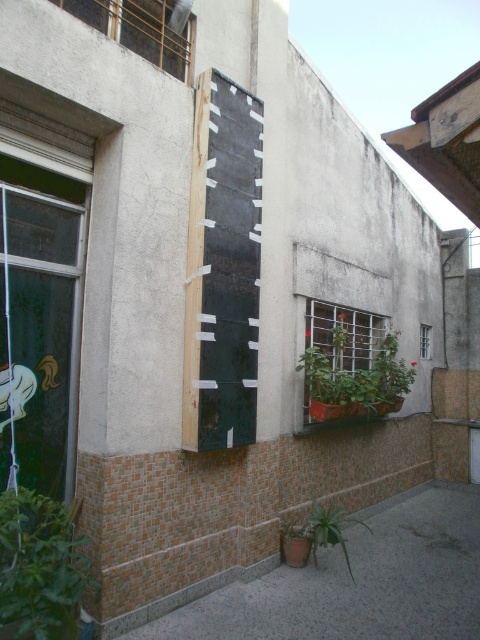
Is brown textured wall at lower right positioned behind dark green wood at center?

No.

Which is more to the left, brown textured wall at lower right or dark green wood at center?

dark green wood at center is more to the left.

I want to click on brown textured wall at lower right, so click(359, 580).

Locate an element on the screen. The width and height of the screenshot is (480, 640). brown textured wall at lower right is located at coordinates (359, 580).

From the picture: Can you confirm if brown textured wall at lower right is shorter than green matte plant at lower center?

Yes.

Who is positioned more to the left, brown textured wall at lower right or green matte plant at lower center?

green matte plant at lower center

Who is more forward, (420, 612) or (343, 540)?

Point (420, 612) is more forward.

Where is `brown textured wall at lower right`? The image size is (480, 640). brown textured wall at lower right is located at coordinates (359, 580).

Does dark green wood at center have a lesser height compared to clear glass window at center?

No, dark green wood at center is not shorter than clear glass window at center.

Who is shorter, dark green wood at center or clear glass window at center?

With less height is clear glass window at center.

Between point (251, 259) and point (421, 353), which one is positioned in front?

Positioned in front is point (251, 259).

The image size is (480, 640). In order to click on dark green wood at center in this screenshot , I will do `click(223, 268)`.